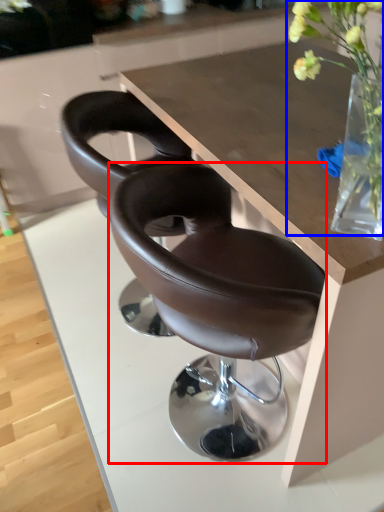
Question: Which point is closer to the camera, chair (highlighted by a red box) or floral arrangement (highlighted by a blue box)?

Choices:
 (A) chair
 (B) floral arrangement

Answer: (B)